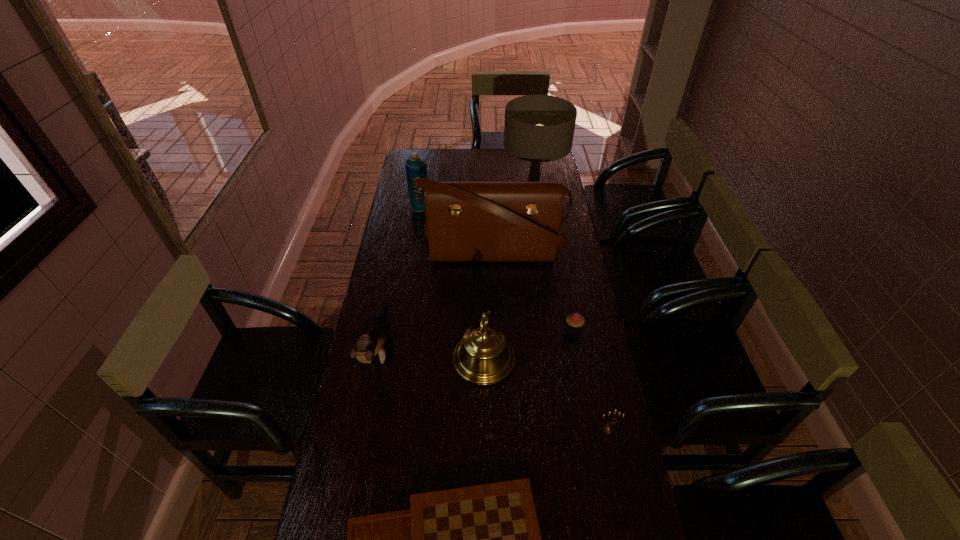
You are a GUI agent. You are given a task and a screenshot of the screen. Output one action in this format:
    pyautogui.click(x=<x>, y=<y>)
    Task: Click on the blank region between the second shortest object and the fifth shortest object
    The height and width of the screenshot is (540, 960).
    Given the screenshot: What is the action you would take?
    pyautogui.click(x=529, y=344)

You are a GUI agent. You are given a task and a screenshot of the screen. Output one action in this format:
    pyautogui.click(x=<x>, y=<y>)
    Task: Click on the free space that is in between the aerosol can and the fifth tallest object
    The image size is (960, 540).
    Given the screenshot: What is the action you would take?
    pos(399,277)

Image resolution: width=960 pixels, height=540 pixels. Find the location of `empty space that is in between the fifth shortest object and the sixth nearest object`. empty space that is in between the fifth shortest object and the sixth nearest object is located at coordinates (489, 307).

You are a GUI agent. You are given a task and a screenshot of the screen. Output one action in this format:
    pyautogui.click(x=<x>, y=<y>)
    Task: Click on the object that is the seventh closest to the seventh farthest object
    
    Given the screenshot: What is the action you would take?
    pyautogui.click(x=416, y=167)

Locate an element on the screen. The width and height of the screenshot is (960, 540). object that ranks as the seventh closest to the fifth shortest object is located at coordinates (416, 167).

Find the location of `free point that satisfies the following two spatial constraints: 1. on the front-facing side of the lampshade; 2. on the front flap of the third farthest object`. free point that satisfies the following two spatial constraints: 1. on the front-facing side of the lampshade; 2. on the front flap of the third farthest object is located at coordinates (541, 253).

You are a GUI agent. You are given a task and a screenshot of the screen. Output one action in this format:
    pyautogui.click(x=<x>, y=<y>)
    Task: Click on the free space that satisfies the following two spatial constraints: 1. on the front-facing side of the sixth tallest object; 2. on the right side of the lampshade
    
    Given the screenshot: What is the action you would take?
    pyautogui.click(x=568, y=429)

Locate an element on the screen. vacant region that satisfies the following two spatial constraints: 1. on the front-facing side of the lampshade; 2. at the face of the fifth tallest object is located at coordinates (556, 348).

The width and height of the screenshot is (960, 540). What are the coordinates of `free space that satisfies the following two spatial constraints: 1. on the front flap of the candelabrum; 2. on the right side of the satchel` in the screenshot? It's located at (500, 429).

You are a GUI agent. You are given a task and a screenshot of the screen. Output one action in this format:
    pyautogui.click(x=<x>, y=<y>)
    Task: Click on the vacant space that satisfies the following two spatial constraints: 1. on the front-facing side of the lampshade; 2. on the right side of the cupcake
    Image resolution: width=960 pixels, height=540 pixels.
    Given the screenshot: What is the action you would take?
    pyautogui.click(x=553, y=328)